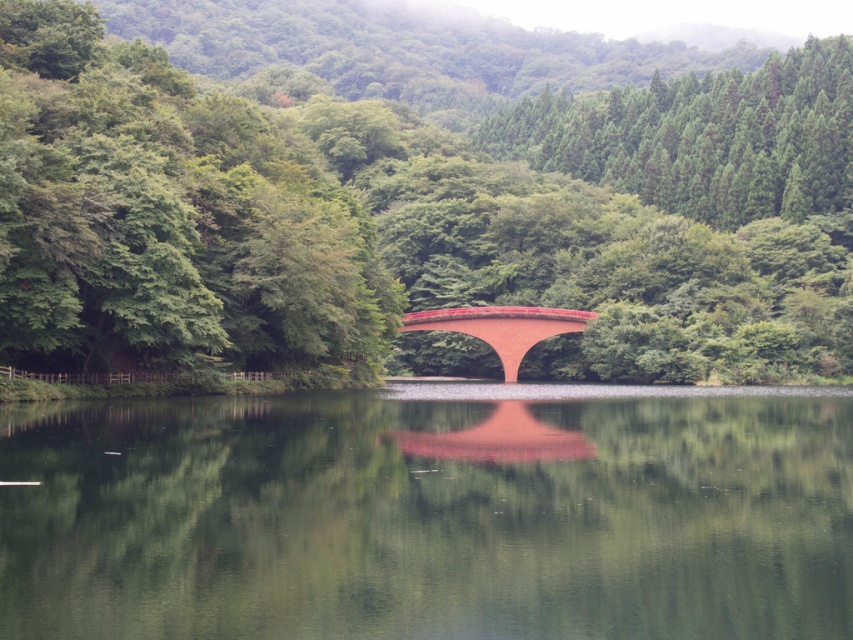
Question: Does green smooth water at center have a larger size compared to smooth red bridge at center?

Choices:
 (A) yes
 (B) no

Answer: (A)

Question: Does matte red bridge at center appear on the right side of green smooth water at center?

Choices:
 (A) yes
 (B) no

Answer: (A)

Question: Can you confirm if matte red bridge at center is bigger than green smooth water at center?

Choices:
 (A) yes
 (B) no

Answer: (A)

Question: Which object appears closest to the camera in this image?

Choices:
 (A) smooth red bridge at center
 (B) matte red bridge at center

Answer: (B)

Question: Which of the following is the closest to the observer?

Choices:
 (A) (477, 320)
 (B) (230, 132)

Answer: (B)

Question: Which of the following is the farthest from the observer?

Choices:
 (A) (527, 605)
 (B) (497, 323)
 (C) (206, 212)

Answer: (B)